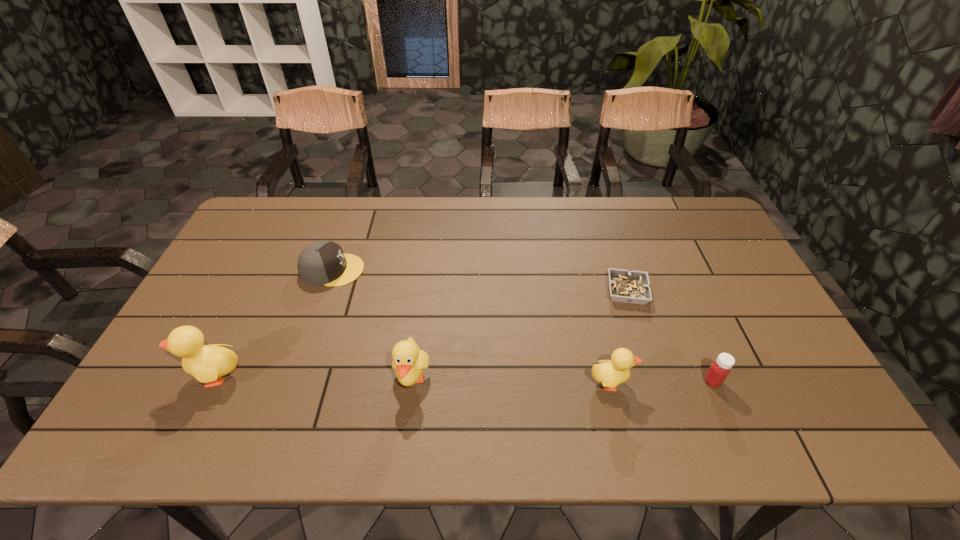
Where is `the leftmost duckling`? This screenshot has height=540, width=960. the leftmost duckling is located at coordinates (208, 364).

I want to click on the second shortest duckling, so click(x=409, y=361).

The height and width of the screenshot is (540, 960). In order to click on the second tallest object in this screenshot , I will do `click(409, 361)`.

Where is `the shortest duckling`? The image size is (960, 540). the shortest duckling is located at coordinates (610, 373).

Image resolution: width=960 pixels, height=540 pixels. Identify the location of the fourth shortest object. (610, 373).

Find the location of a particular element. The image size is (960, 540). the second object from left to right is located at coordinates (323, 263).

At what (x,y) coordinates should I click in order to perform the action: click on medicine. Please return your answer as a coordinate pair (x, y). Looking at the image, I should click on (720, 368).

Find the location of a particular element. ashtray is located at coordinates (632, 287).

Where is `free region located 0.060m on the front-facing side of the leftmost object`? The width and height of the screenshot is (960, 540). free region located 0.060m on the front-facing side of the leftmost object is located at coordinates (161, 375).

You are a GUI agent. You are given a task and a screenshot of the screen. Output one action in this format:
    pyautogui.click(x=<x>, y=<y>)
    Task: Click on the free region located 0.150m on the front-facing side of the fourth shortest object
    
    Given the screenshot: What is the action you would take?
    pyautogui.click(x=693, y=382)